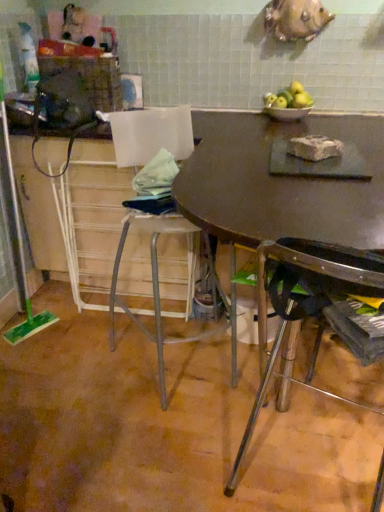
Where is `vacant region to the left of metallic silver stool at center, which ranks as the second chair in right-to-left order`? This screenshot has width=384, height=512. vacant region to the left of metallic silver stool at center, which ranks as the second chair in right-to-left order is located at coordinates (68, 374).